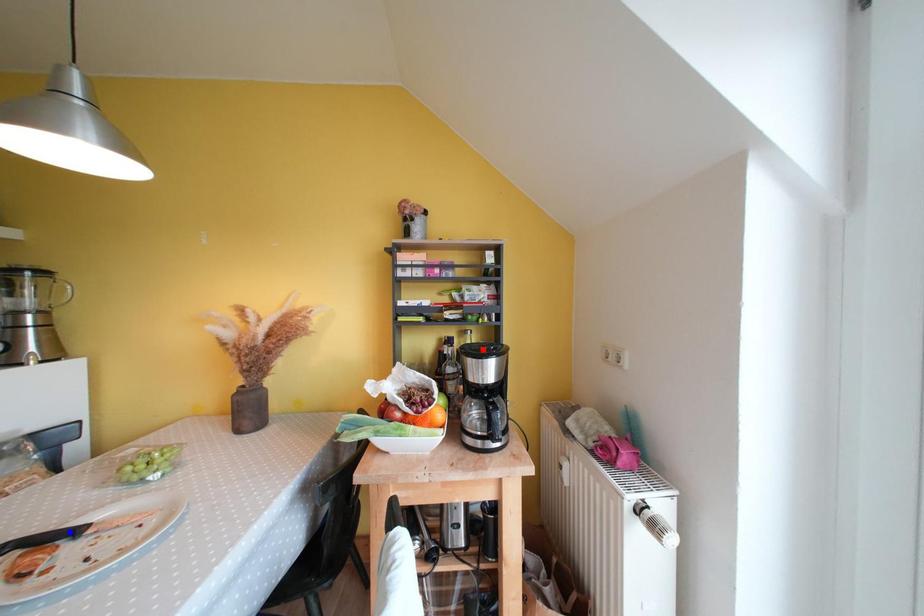
Question: Two points are marked on the image. Which point is closer to the camera?

Choices:
 (A) Blue point is closer.
 (B) Red point is closer.

Answer: (A)